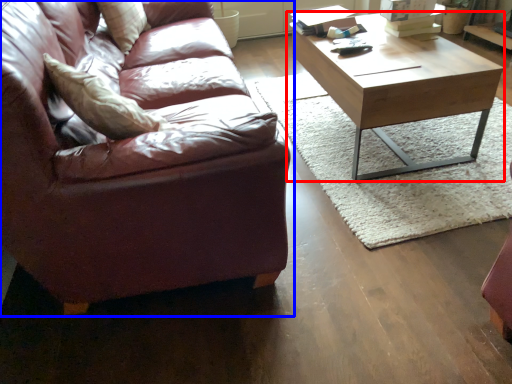
Question: Which point is further to the camera, coffee table (highlighted by a red box) or studio couch (highlighted by a blue box)?

Choices:
 (A) coffee table
 (B) studio couch

Answer: (A)